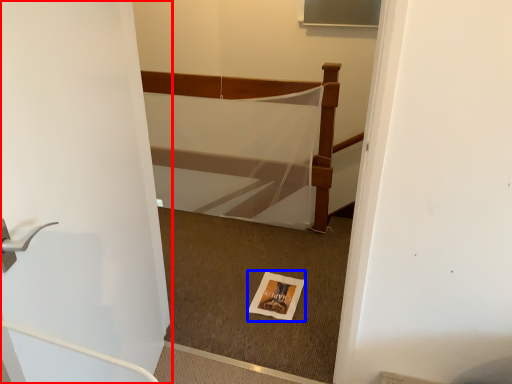
Question: Which object appears closest to the camera in this image, door (highlighted by a red box) or postcard (highlighted by a blue box)?

Choices:
 (A) door
 (B) postcard

Answer: (A)